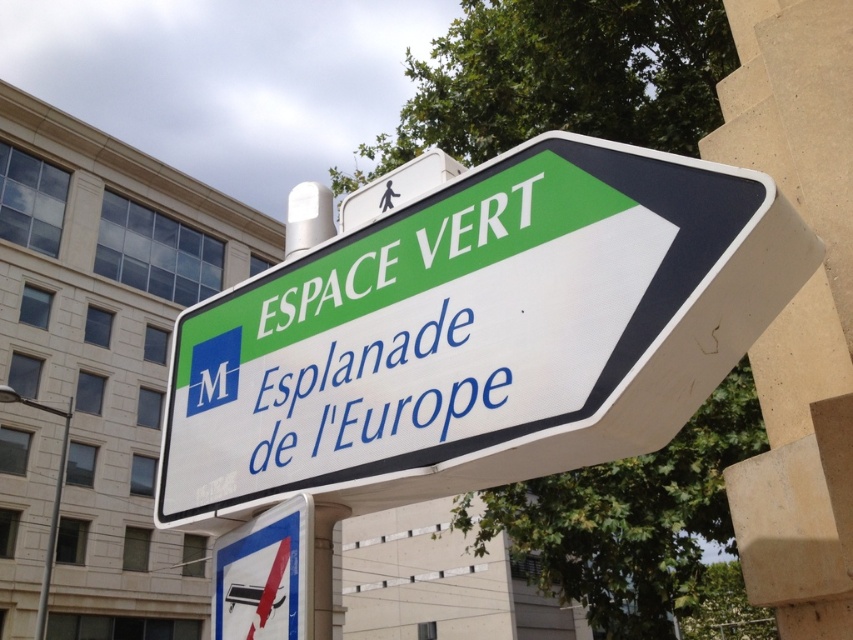
Question: Considering the real-world distances, which object is closest to the white plastic sign at center?

Choices:
 (A) white paper sign at center
 (B) white plastic sign at lower left

Answer: (A)

Question: Estimate the real-world distances between objects in this image. Which object is closer to the white paper sign at center?

Choices:
 (A) white plastic sign at upper center
 (B) white plastic sign at lower left
 (C) white plastic sign at center

Answer: (C)

Question: Is white plastic sign at center smaller than white paper sign at center?

Choices:
 (A) no
 (B) yes

Answer: (A)

Question: Does white paper sign at center appear over white plastic sign at upper center?

Choices:
 (A) yes
 (B) no

Answer: (B)

Question: Which of these objects is positioned farthest from the white plastic sign at upper center?

Choices:
 (A) white plastic sign at lower left
 (B) white paper sign at center
 (C) white plastic sign at center

Answer: (A)

Question: Is white plastic sign at center smaller than white paper sign at center?

Choices:
 (A) yes
 (B) no

Answer: (B)